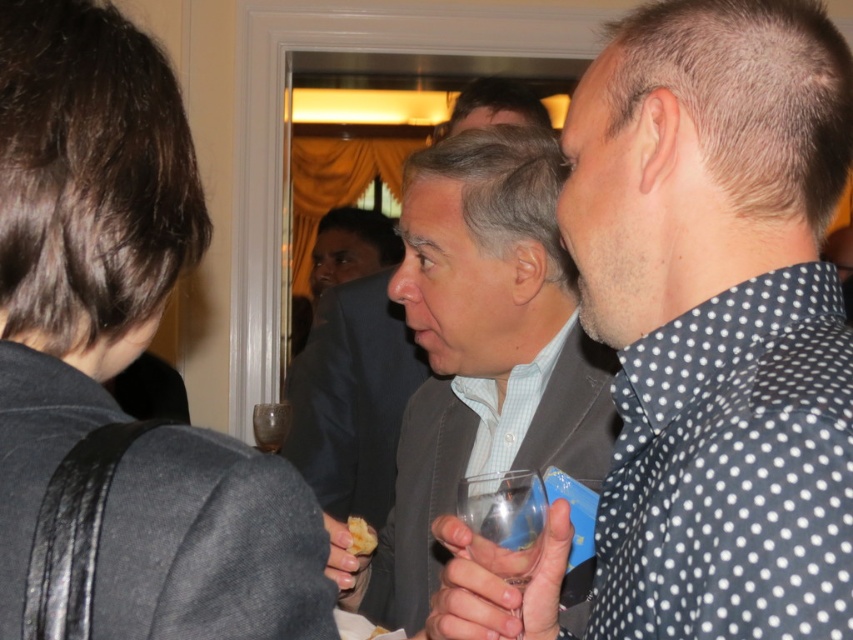
Question: Is dark gray fabric at upper left to the left of transparent glass at center from the viewer's perspective?

Choices:
 (A) no
 (B) yes

Answer: (B)

Question: Among these points, which one is nearest to the camera?

Choices:
 (A) pyautogui.click(x=364, y=528)
 (B) pyautogui.click(x=515, y=490)
 (C) pyautogui.click(x=148, y=298)
 (D) pyautogui.click(x=279, y=412)

Answer: (C)

Question: Can you confirm if gray suit jacket at center is thinner than yellowish matte bread at center?

Choices:
 (A) yes
 (B) no

Answer: (B)

Question: Does gray suit jacket at center have a larger size compared to translucent glass wine glass at center?

Choices:
 (A) yes
 (B) no

Answer: (A)

Question: Which of the following is the closest to the observer?

Choices:
 (A) translucent glass wine glass at center
 (B) gray suit jacket at center

Answer: (B)

Question: Which point is farther from the camera taking this photo?

Choices:
 (A) (195, 584)
 (B) (519, 518)
 (C) (828, 401)
 (D) (254, 435)

Answer: (D)